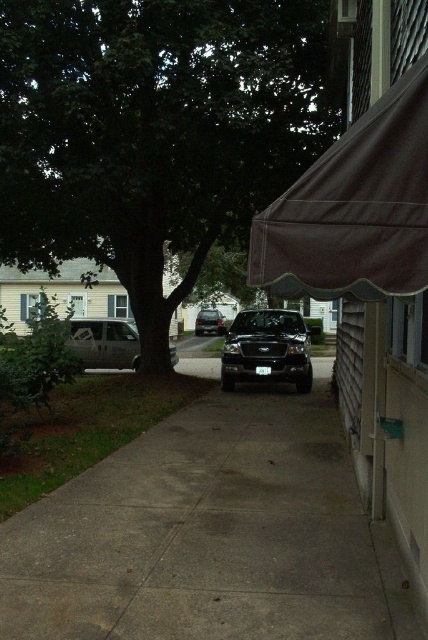
Question: Is brown fabric awning at upper right thinner than silver metallic van at left?

Choices:
 (A) yes
 (B) no

Answer: (A)

Question: Considering the real-world distances, which object is farthest from the shiny black suv at center?

Choices:
 (A) black matte truck at center
 (B) green leafy tree at center
 (C) gray concrete pavement at center

Answer: (C)

Question: Considering the relative positions of brown fabric awning at upper right and shiny black suv at center in the image provided, where is brown fabric awning at upper right located with respect to shiny black suv at center?

Choices:
 (A) left
 (B) right

Answer: (B)

Question: Considering the relative positions of silver metallic van at left and shiny black suv at center in the image provided, where is silver metallic van at left located with respect to shiny black suv at center?

Choices:
 (A) below
 (B) above

Answer: (A)

Question: Considering the real-world distances, which object is closest to the silver metallic van at left?

Choices:
 (A) shiny black suv at center
 (B) gray concrete pavement at center
 (C) brown fabric awning at upper right
 (D) green leafy tree at center

Answer: (D)

Question: Which object is the farthest from the shiny black suv at center?

Choices:
 (A) black matte truck at center
 (B) green leafy tree at center
 (C) gray concrete pavement at center
 (D) silver metallic van at left

Answer: (C)